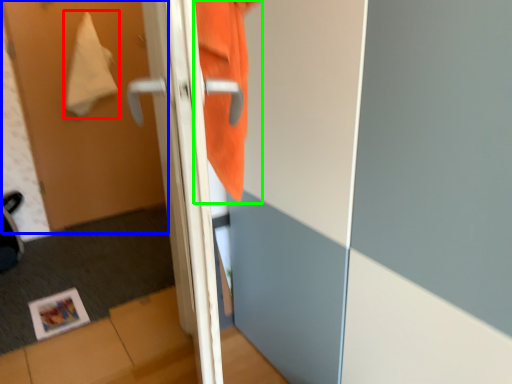
Question: Which object is the farthest from blanket (highlighted by a red box)? Choose among these: screen door (highlighted by a blue box) or sweatshirt (highlighted by a green box).

Choices:
 (A) screen door
 (B) sweatshirt

Answer: (B)